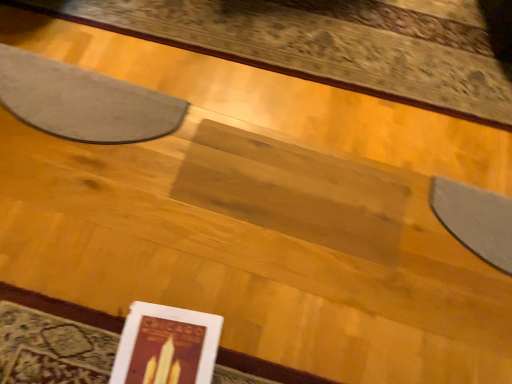
Locate an element on the screen. This screenshot has width=512, height=384. vacant space underneath matte paper book at lower left (from a real-world perspective) is located at coordinates (173, 348).